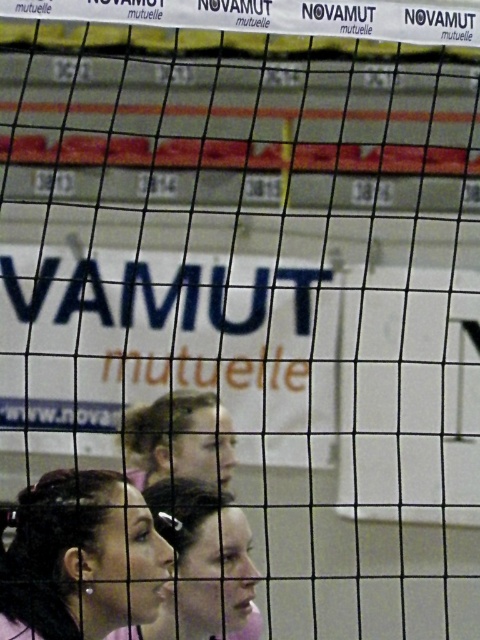
Question: Observing the image, what is the correct spatial positioning of matte pink shirt at lower left in reference to blonde hair at center?

Choices:
 (A) below
 (B) above

Answer: (A)

Question: Among these objects, which one is nearest to the camera?

Choices:
 (A) blonde hair at center
 (B) matte pink shirt at lower left

Answer: (B)

Question: In this image, where is pink fabric at lower center located relative to blonde hair at center?

Choices:
 (A) right
 (B) left

Answer: (A)

Question: Among these objects, which one is farthest from the camera?

Choices:
 (A) pink fabric at lower center
 (B) matte pink shirt at lower left
 (C) blonde hair at center

Answer: (C)

Question: Which of the following is the closest to the observer?

Choices:
 (A) (212, 433)
 (B) (201, 589)
 (C) (52, 506)

Answer: (C)

Question: Can you confirm if matte pink shirt at lower left is smaller than blonde hair at center?

Choices:
 (A) yes
 (B) no

Answer: (A)